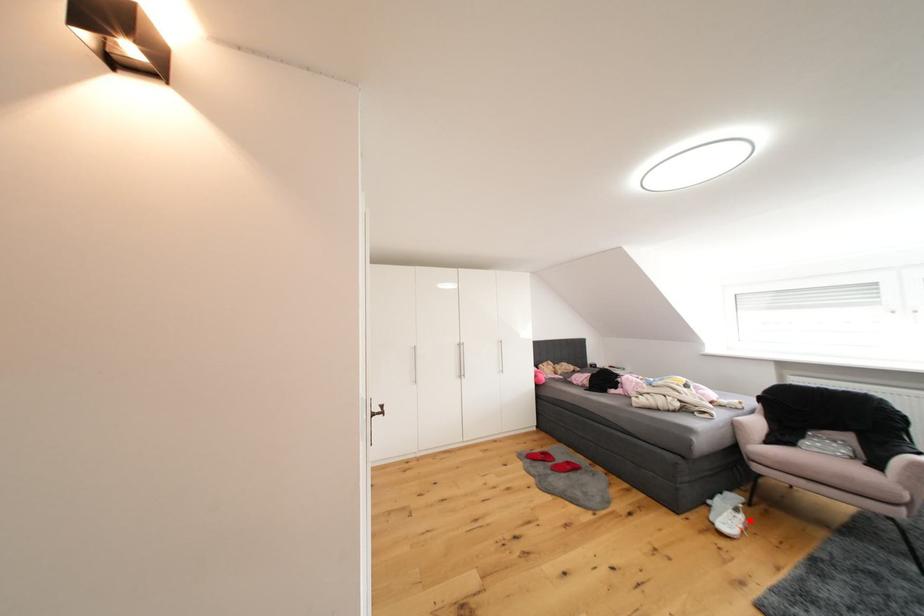
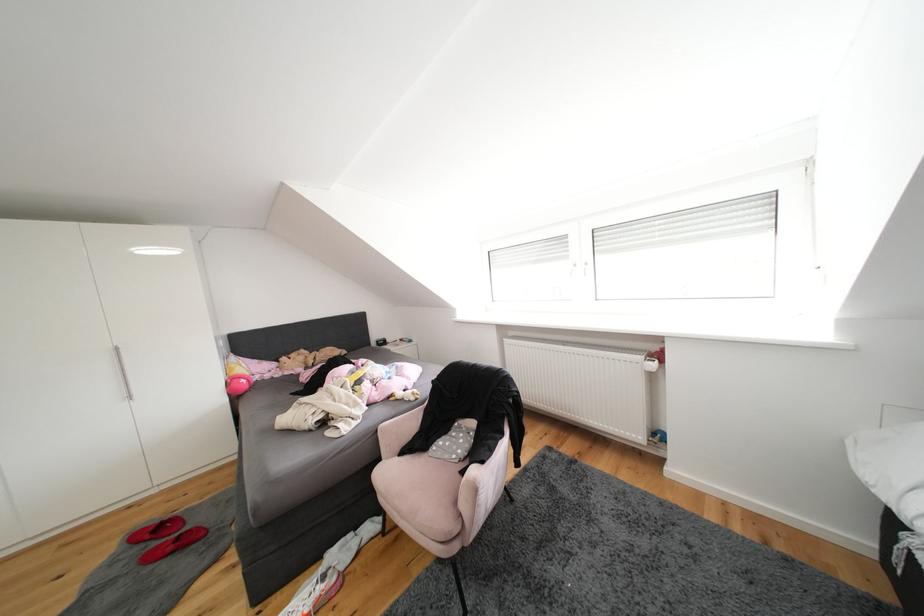
Question: A red point is marked in image1. In image2, is the corresponding 3D point closer to the camera or farther? Reply with the corresponding letter.

Choices:
 (A) The corresponding 3D point is closer.
 (B) The corresponding 3D point is farther.

Answer: (B)